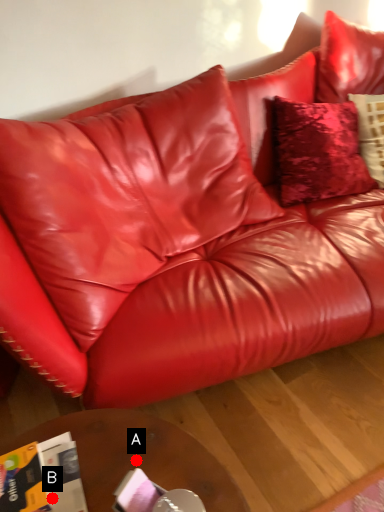
Question: Two points are circled on the image, labeled by A and B beside each circle. Among these points, which one is nearest to the camera?

Choices:
 (A) A is closer
 (B) B is closer

Answer: (B)